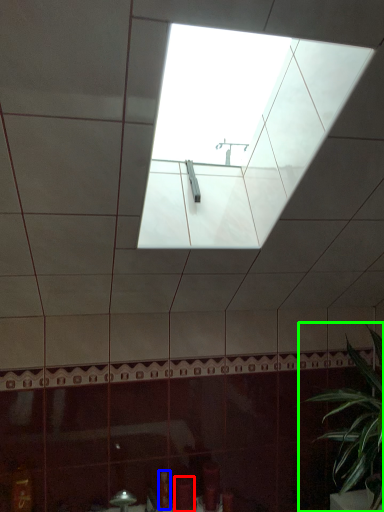
Question: Considering the real-world distances, which object is farthest from toiletry (highlighted by a red box)? toiletry (highlighted by a blue box) or houseplant (highlighted by a green box)?

Choices:
 (A) toiletry
 (B) houseplant

Answer: (B)